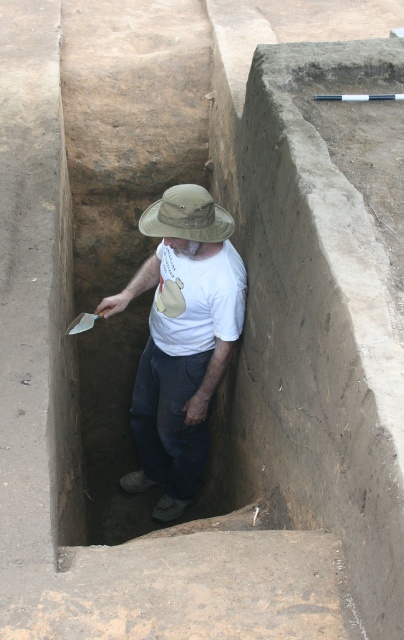
Question: Which object is closer to the camera taking this photo?

Choices:
 (A) white plastic shovel at lower center
 (B) khaki fabric hat at center
 (C) white matte t-shirt at center

Answer: (B)

Question: Which point is farther to the camera?

Choices:
 (A) khaki fabric hat at center
 (B) white plastic shovel at lower center
 (C) white matte t-shirt at center

Answer: (B)

Question: Does khaki fabric hat at center appear under white plastic shovel at lower center?

Choices:
 (A) yes
 (B) no

Answer: (B)

Question: Can you confirm if white matte t-shirt at center is bigger than white plastic shovel at lower center?

Choices:
 (A) yes
 (B) no

Answer: (A)

Question: Can you confirm if khaki fabric hat at center is positioned to the left of white plastic shovel at lower center?

Choices:
 (A) yes
 (B) no

Answer: (B)

Question: Which point appears closest to the camera in this image?

Choices:
 (A) (187, 193)
 (B) (82, 320)

Answer: (A)